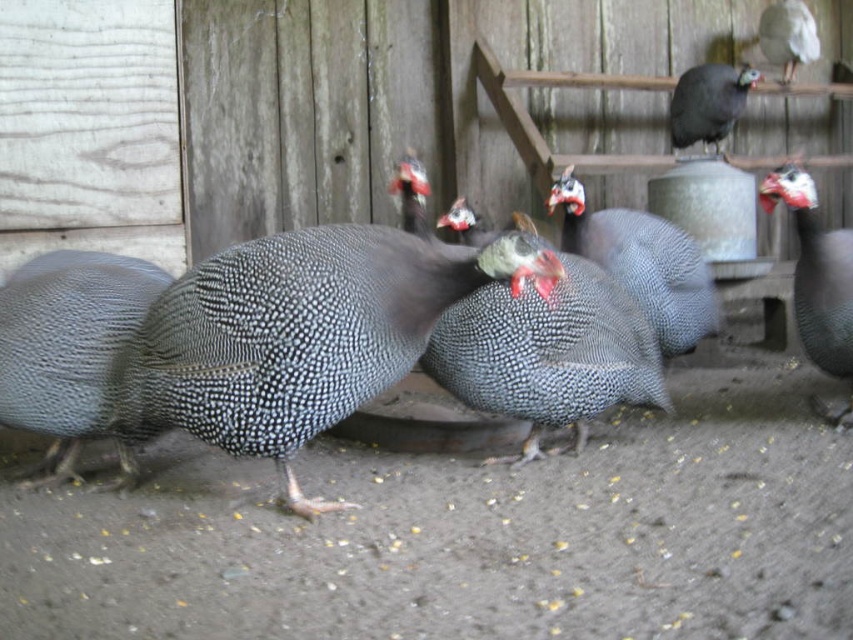
You are a farmer checking the guinea fowl in the coop. You notice a point marked at coordinates (547, 353). What animal is located at that point?

The pearlized gray guinea fowl at center is located at point (547, 353).

You are a farmer checking the coop and notice two guinea fowl at the center. How far apart are the pearlized gray guinea fowl at center and the speckled feathered guinea fowl at center?

The pearlized gray guinea fowl at center and the speckled feathered guinea fowl at center are 14.33 inches apart.

You are a farmer checking on your guinea fowl in the coop. You see two guinea fowl, the speckled feathered guinea fowl at center and the speckled feathered guinea fowl at right. Which one is closer to you?

The speckled feathered guinea fowl at center is closer to you because it is further to the viewer than the speckled feathered guinea fowl at right.